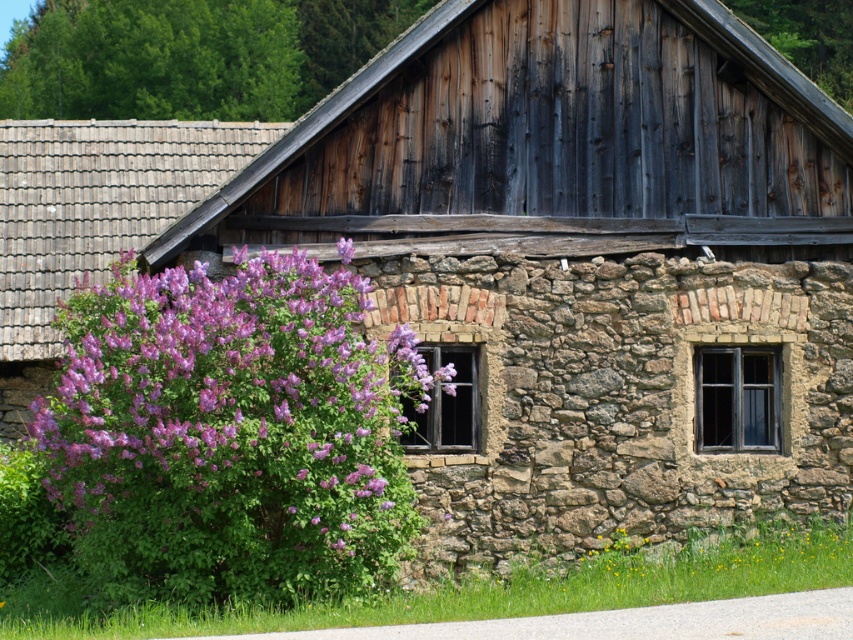
You are standing in front of the rustic stone building and want to know which of the purple leafy bushes is wider. Can you determine if the purple leafy bush at left is wider than the purple leafy bush at upper center?

The purple leafy bush at left might be wider than the purple leafy bush at upper center according to the description provided.